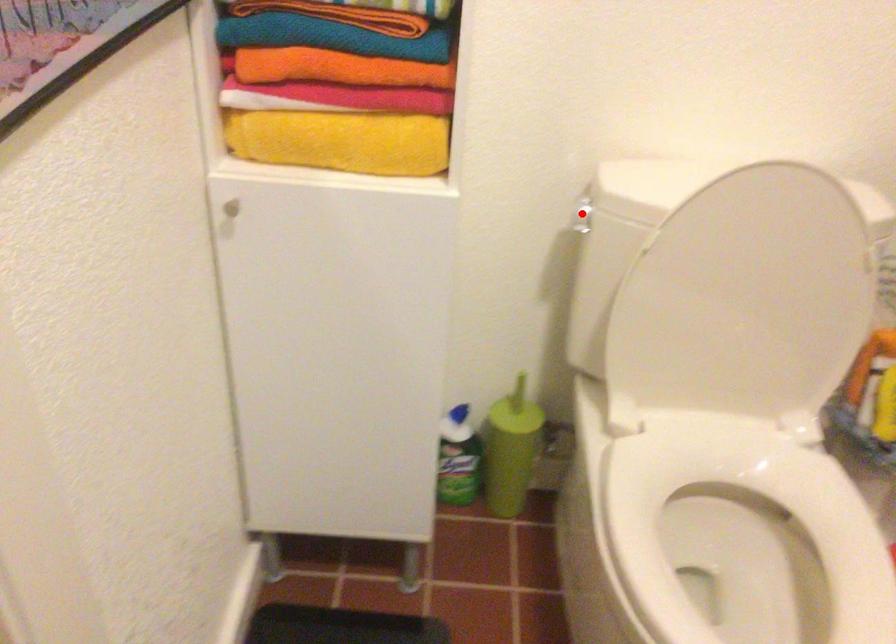
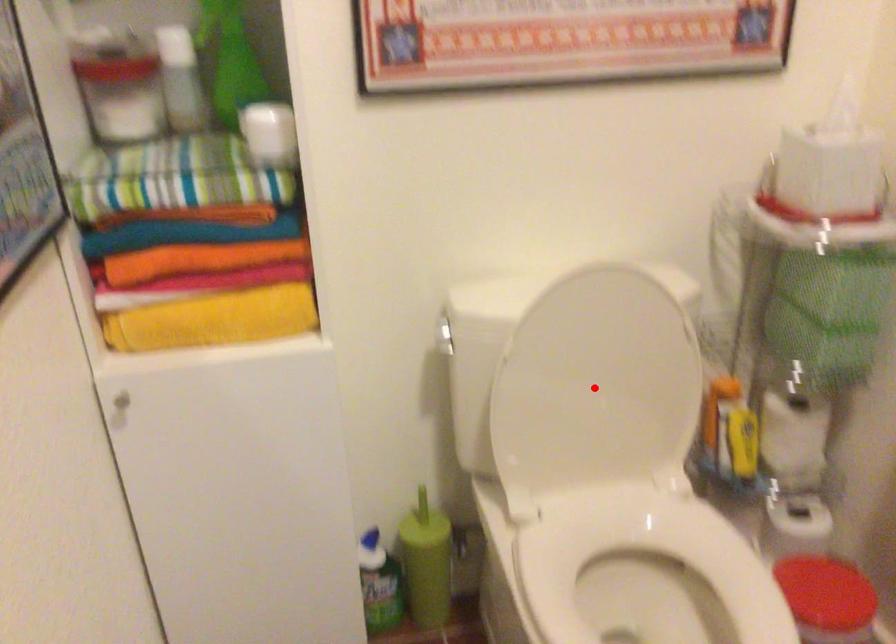
I am providing you with two images of the same scene from different viewpoints. A red point is marked on the first image and another point is marked on the second image. Is the marked point in image1 the same physical position as the marked point in image2?

No